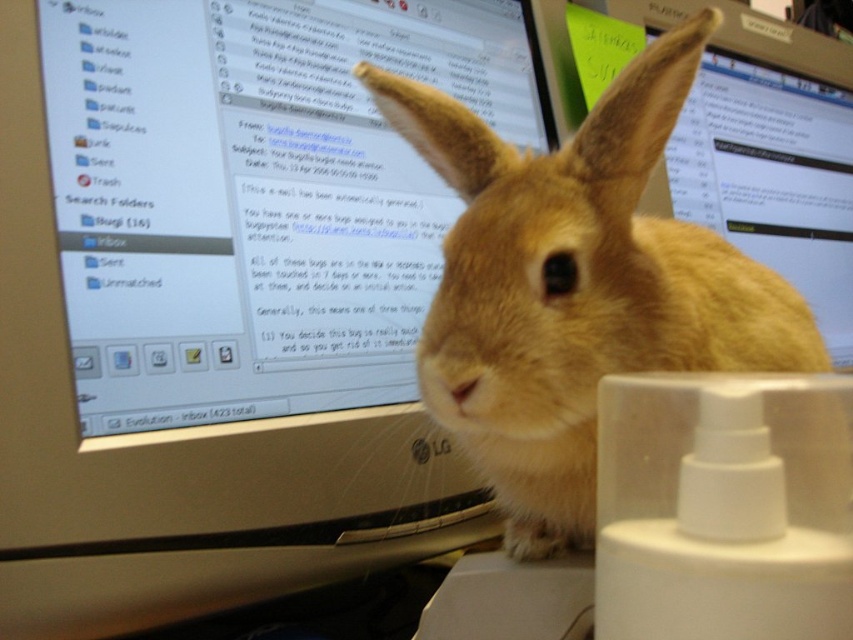
Does white plastic monitor at upper center have a larger size compared to matte plastic monitor at center?

No.

Which is behind, point (128, 428) or point (796, 198)?

The point (796, 198) is behind.

Where is `white plastic monitor at upper center`? The width and height of the screenshot is (853, 640). white plastic monitor at upper center is located at coordinates pos(225,298).

Does point (660, 330) come in front of point (834, 88)?

Yes, point (660, 330) is in front of point (834, 88).

Locate an element on the screen. The width and height of the screenshot is (853, 640). furry beige rabbit at center is located at coordinates (576, 285).

Find the location of a particular element. This screenshot has width=853, height=640. furry beige rabbit at center is located at coordinates (576, 285).

Does white plastic monitor at upper center appear on the left side of furry beige rabbit at center?

Indeed, white plastic monitor at upper center is positioned on the left side of furry beige rabbit at center.

At what (x,y) coordinates should I click in order to perform the action: click on white plastic monitor at upper center. Please return your answer as a coordinate pair (x, y). The image size is (853, 640). Looking at the image, I should click on (225, 298).

I want to click on white plastic monitor at upper center, so click(225, 298).